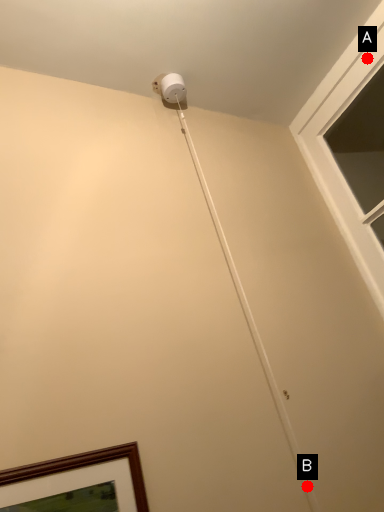
Question: Two points are circled on the image, labeled by A and B beside each circle. Which point is farther to the camera?

Choices:
 (A) A is further
 (B) B is further

Answer: (A)